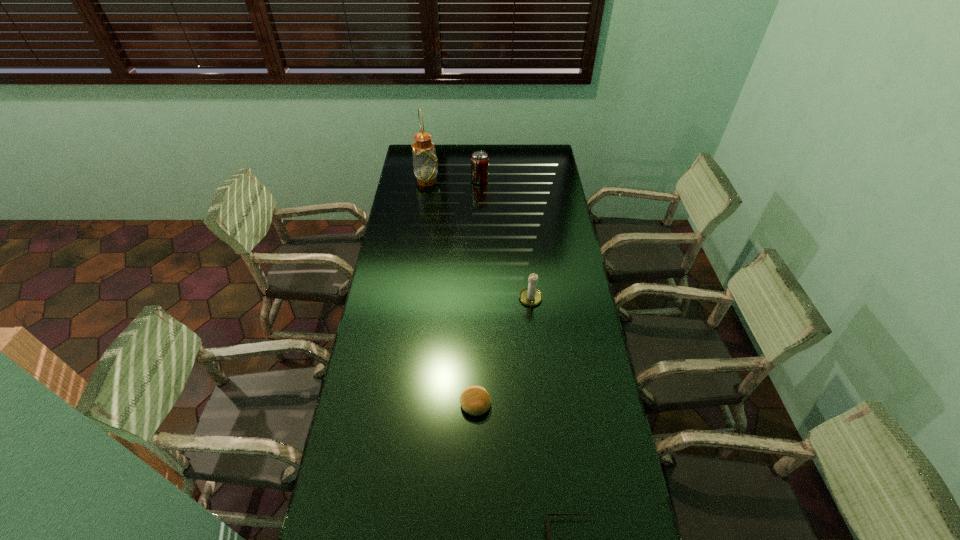
The width and height of the screenshot is (960, 540). Find the location of `object at the left edge`. object at the left edge is located at coordinates (425, 162).

Locate an element on the screen. This screenshot has width=960, height=540. free region at the far edge of the desktop is located at coordinates click(x=514, y=151).

Locate an element on the screen. vacant space at the left edge of the desktop is located at coordinates (386, 457).

Where is `vacant space at the right edge of the desktop`? vacant space at the right edge of the desktop is located at coordinates (555, 261).

At what (x,y) coordinates should I click in order to perform the action: click on free region at the far left corner of the desktop. Please return your answer as a coordinate pair (x, y). Looking at the image, I should click on (408, 157).

Find the location of a particular element. The height and width of the screenshot is (540, 960). free point between the candle holder and the tallest object is located at coordinates (479, 240).

What are the coordinates of `free spot between the candle holder and the leftmost object` in the screenshot? It's located at click(479, 240).

Locate an element on the screen. The width and height of the screenshot is (960, 540). vacant space in between the candle holder and the pop soda is located at coordinates (505, 240).

Find the location of a particular element. The height and width of the screenshot is (540, 960). free space between the tallest object and the pop soda is located at coordinates (454, 181).

This screenshot has height=540, width=960. Find the location of `free point between the oil lamp and the third farthest object`. free point between the oil lamp and the third farthest object is located at coordinates coord(479,240).